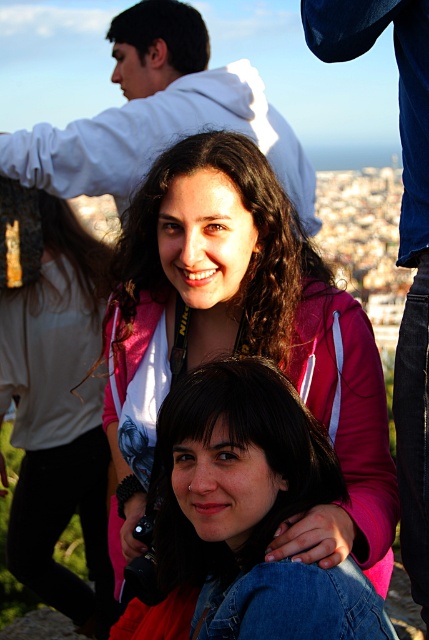
Question: Does pink fleece jacket at center appear over white hoodie at upper center?

Choices:
 (A) yes
 (B) no

Answer: (B)

Question: Can you confirm if pink fleece jacket at center is positioned to the right of white hoodie at upper center?

Choices:
 (A) yes
 (B) no

Answer: (A)

Question: Which point is closer to the camera?

Choices:
 (A) pink fleece jacket at center
 (B) white hoodie at upper center

Answer: (A)

Question: Which object appears farthest from the camera in this image?

Choices:
 (A) pink fleece jacket at center
 (B) white hoodie at upper center

Answer: (B)

Question: Is pink fleece jacket at center to the left of white hoodie at upper center from the viewer's perspective?

Choices:
 (A) yes
 (B) no

Answer: (B)